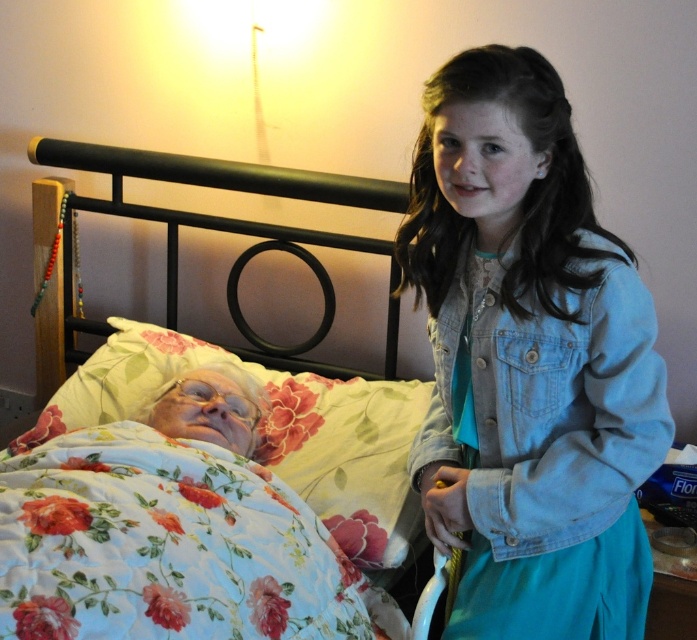
Question: Is floral cotton quilt at lower left to the right of metallic black bed at upper left from the viewer's perspective?

Choices:
 (A) yes
 (B) no

Answer: (A)

Question: Which object is farther from the camera taking this photo?

Choices:
 (A) floral cotton quilt at lower left
 (B) floral fabric pillow at left
 (C) denim jacket at right

Answer: (B)

Question: Can you confirm if denim jacket at right is thinner than metallic black bed at upper left?

Choices:
 (A) no
 (B) yes

Answer: (B)

Question: Considering the real-world distances, which object is closest to the denim jacket at right?

Choices:
 (A) floral cotton quilt at lower left
 (B) floral fabric pillow at left

Answer: (A)

Question: Can you confirm if floral cotton quilt at lower left is positioned to the right of metallic black bed at upper left?

Choices:
 (A) no
 (B) yes

Answer: (B)

Question: Which object is positioned farthest from the denim jacket at right?

Choices:
 (A) metallic black bed at upper left
 (B) floral cotton quilt at lower left

Answer: (A)